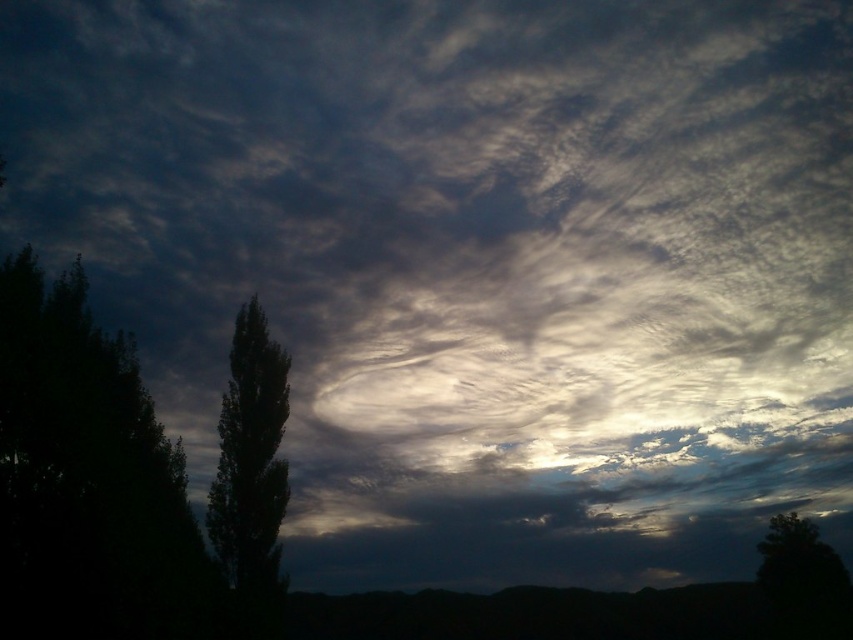
Can you confirm if dark green leafy tree at left is positioned below dark green leafy tree at lower right?

Actually, dark green leafy tree at left is above dark green leafy tree at lower right.

Does dark green leafy tree at left have a lesser width compared to dark green leafy tree at lower right?

In fact, dark green leafy tree at left might be wider than dark green leafy tree at lower right.

Does point (158, 598) come closer to viewer compared to point (820, 621)?

Yes.

This screenshot has width=853, height=640. Find the location of `dark green leafy tree at left`. dark green leafy tree at left is located at coordinates (86, 480).

Does dark green leafy tree at left appear on the left side of green leafy tree at left?

Yes, dark green leafy tree at left is to the left of green leafy tree at left.

Is dark green leafy tree at left smaller than green leafy tree at left?

No, dark green leafy tree at left is not smaller than green leafy tree at left.

Who is more distant from viewer, (86, 596) or (271, 385)?

Positioned behind is point (271, 385).

Where is `dark green leafy tree at left`? The image size is (853, 640). dark green leafy tree at left is located at coordinates (86, 480).

Can you confirm if green leafy tree at left is positioned to the right of dark green leafy tree at lower right?

Incorrect, green leafy tree at left is not on the right side of dark green leafy tree at lower right.

Which is behind, point (260, 433) or point (802, 557)?

Point (802, 557)

At what (x,y) coordinates should I click in order to perform the action: click on green leafy tree at left. Please return your answer as a coordinate pair (x, y). Image resolution: width=853 pixels, height=640 pixels. Looking at the image, I should click on (250, 458).